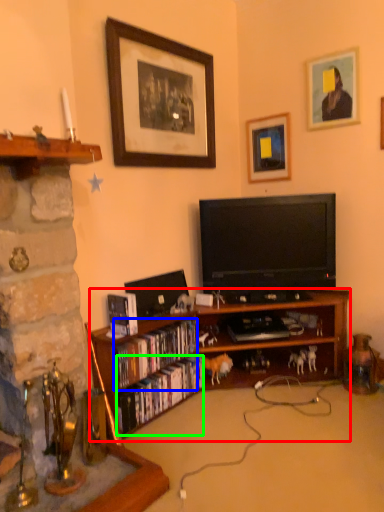
Question: Based on their relative distances, which object is farther from bookcase (highlighted by a red box)? Choose from book (highlighted by a blue box) and book (highlighted by a green box).

Choices:
 (A) book
 (B) book

Answer: (A)